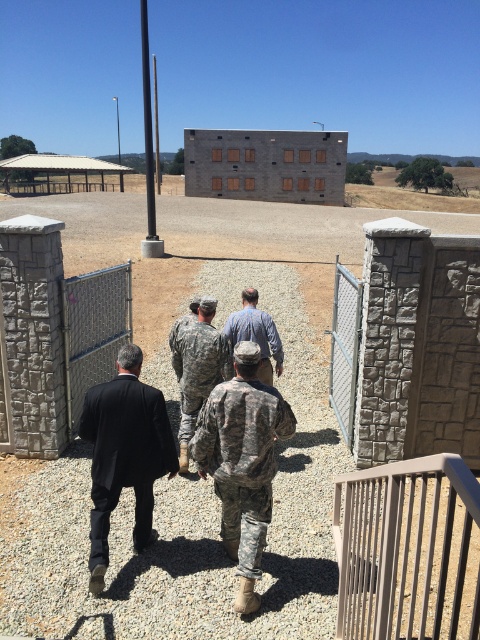
Is brown metal fence at lower right thinner than camouflage uniform at center?

Incorrect, brown metal fence at lower right's width is not less than camouflage uniform at center's.

Locate an element on the screen. brown metal fence at lower right is located at coordinates (408, 550).

At what (x,y) coordinates should I click in order to perform the action: click on brown metal fence at lower right. Please return your answer as a coordinate pair (x, y). The image size is (480, 640). Looking at the image, I should click on (408, 550).

Between point (78, 404) and point (189, 339), which one is positioned in front?

Positioned in front is point (189, 339).

Describe the element at coordinates (94, 330) in the screenshot. I see `wire mesh fence at center` at that location.

The height and width of the screenshot is (640, 480). Identify the location of wire mesh fence at center. (94, 330).

Does brown metal fence at lower right have a larger size compared to wire mesh fence at center?

Indeed, brown metal fence at lower right has a larger size compared to wire mesh fence at center.

What are the coordinates of `brown metal fence at lower right` in the screenshot? It's located at (408, 550).

Is point (410, 496) more distant than point (99, 298)?

No, it is not.

Where is `brown metal fence at lower right`? brown metal fence at lower right is located at coordinates (408, 550).